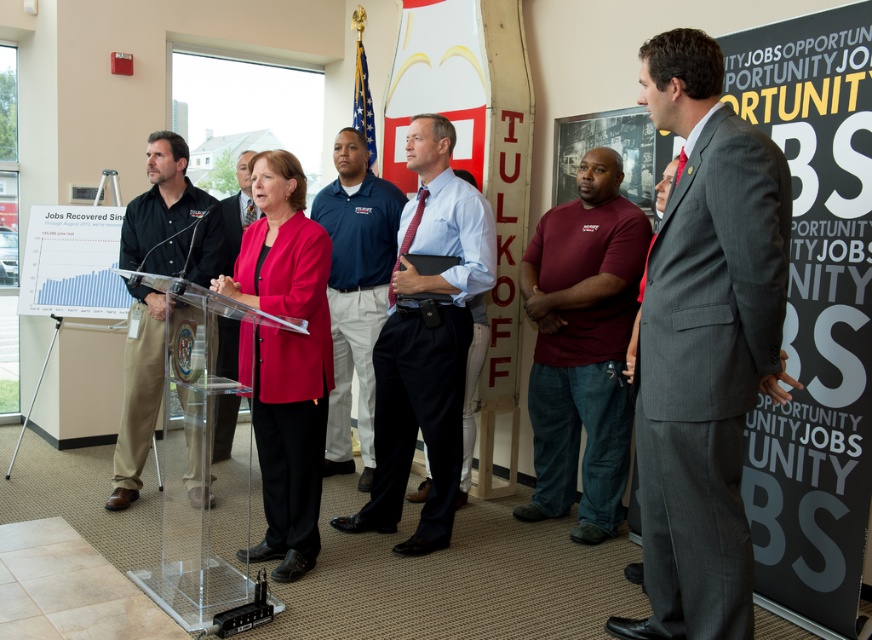
You are attending a press conference and need to place a name tag on the transparent acrylic podium at center. However, there is a person wearing a light blue shirt at center currently standing there. Can you place the name tag on the podium without moving the person?

The light blue shirt at center is positioned over transparent acrylic podium at center, meaning the person is blocking access to the podium. You would need to ask them to step aside to place the name tag.

You are attending a press conference and need to locate the black shirt at left and the white paper chart at center. From the perspective of someone facing the front of the room, which object is positioned to the right?

The black shirt at left is to the right of the white paper chart at center, so the black shirt at left is positioned to the right.